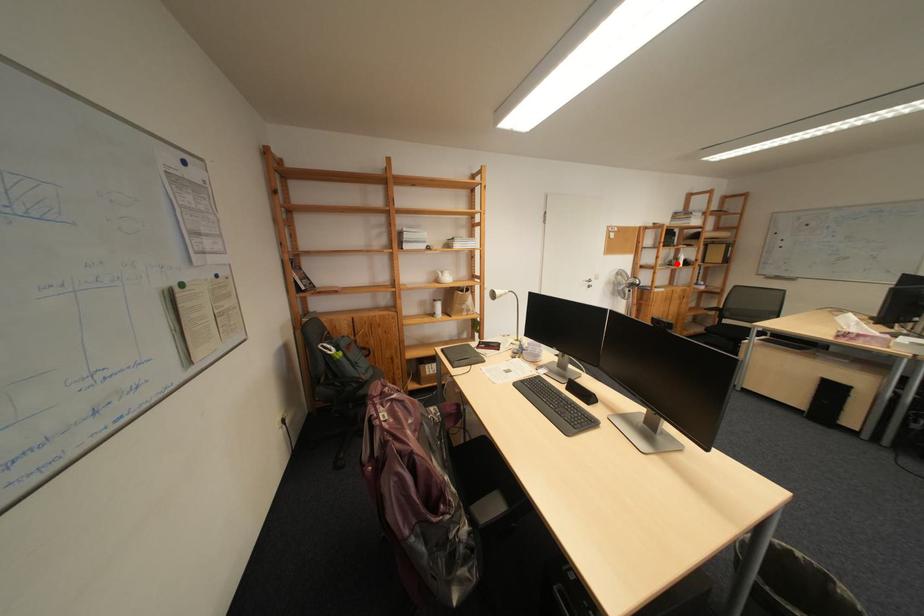
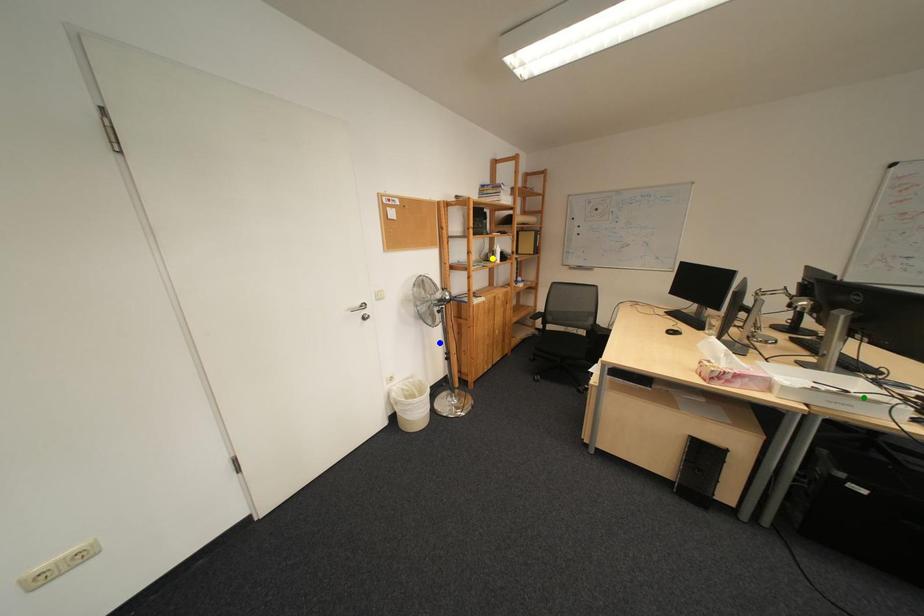
Question: I am providing you with two images of the same scene from different viewpoints. A red point is marked on the first image. You are given multiple points on the second image. Which mark in image 2 goes with the point in image 1?

Choices:
 (A) green point
 (B) yellow point
 (C) blue point

Answer: (B)